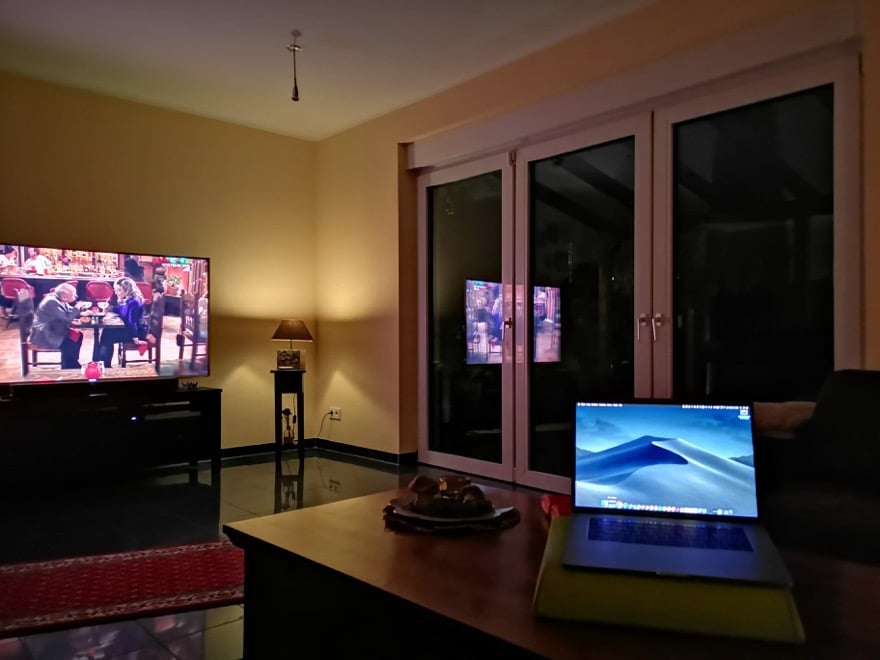
Locate an element on the screen. trackpad is located at coordinates (665, 561).